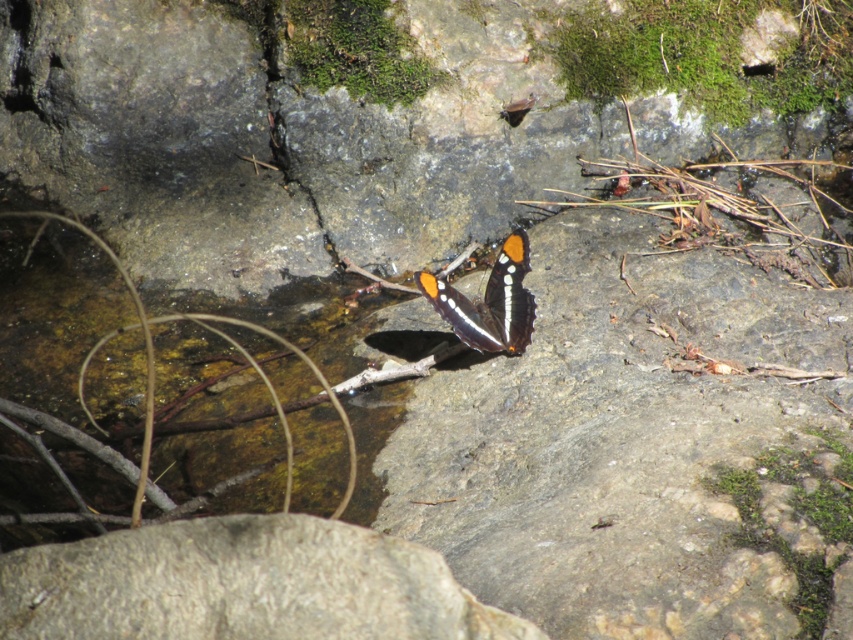
Question: Can you confirm if gray rough boulder at center is positioned below shiny orange and black wings at center?

Choices:
 (A) no
 (B) yes

Answer: (B)

Question: Which object appears farthest from the camera in this image?

Choices:
 (A) shiny orange and black wings at center
 (B) gray rough boulder at center

Answer: (A)

Question: Is gray rough boulder at center smaller than shiny orange and black wings at center?

Choices:
 (A) no
 (B) yes

Answer: (B)

Question: Which of the following is the farthest from the observer?

Choices:
 (A) (386, 570)
 (B) (524, 262)

Answer: (B)

Question: Among these points, which one is nearest to the camera?

Choices:
 (A) (494, 292)
 (B) (158, 582)

Answer: (B)

Question: Can you confirm if gray rough boulder at center is positioned to the left of shiny orange and black wings at center?

Choices:
 (A) yes
 (B) no

Answer: (A)